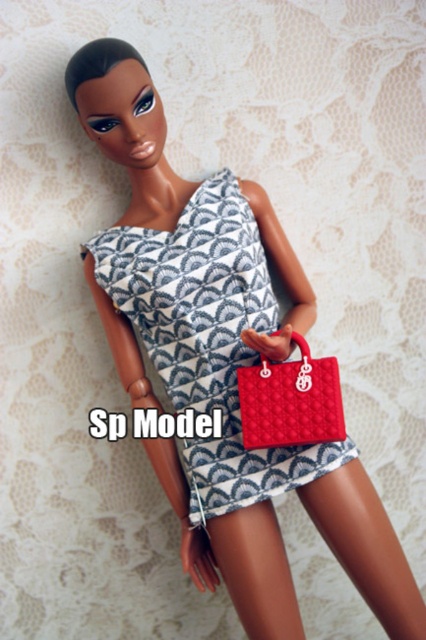
Question: Does patterned fabric dress at center have a larger size compared to matte red handbag at lower right?

Choices:
 (A) no
 (B) yes

Answer: (B)

Question: Which object is closer to the camera taking this photo?

Choices:
 (A) matte red handbag at lower right
 (B) patterned fabric dress at center

Answer: (A)

Question: Which of the following is the farthest from the observer?

Choices:
 (A) matte red handbag at lower right
 (B) patterned fabric dress at center

Answer: (B)

Question: Does patterned fabric dress at center come in front of matte red handbag at lower right?

Choices:
 (A) no
 (B) yes

Answer: (A)

Question: Can you confirm if patterned fabric dress at center is positioned to the left of matte red handbag at lower right?

Choices:
 (A) no
 (B) yes

Answer: (B)